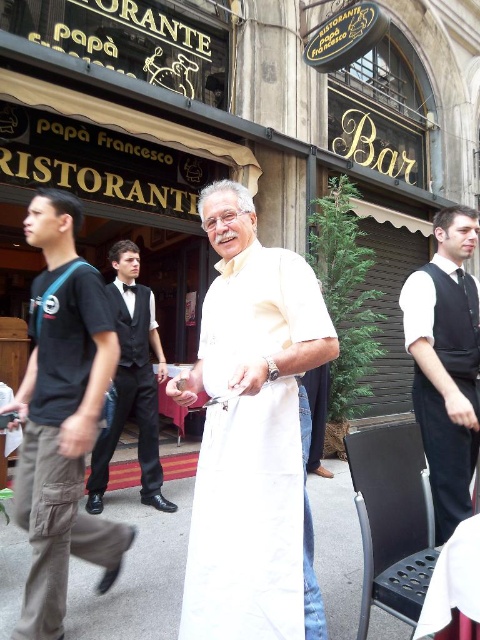
Can you confirm if black cotton t-shirt at left is positioned above black satin vest at right?

No.

Is point (45, 481) closer to camera compared to point (415, 397)?

Yes, point (45, 481) is in front of point (415, 397).

What do you see at coordinates (61, 417) in the screenshot? I see `black cotton t-shirt at left` at bounding box center [61, 417].

What are the coordinates of `black cotton t-shirt at left` in the screenshot? It's located at (61, 417).

Between white fabric apron at center and black satin vest at center, which one is positioned lower?

black satin vest at center is below.

Who is positioned more to the left, white fabric apron at center or black satin vest at center?

black satin vest at center is more to the left.

Describe the element at coordinates (252, 435) in the screenshot. I see `white fabric apron at center` at that location.

This screenshot has height=640, width=480. I want to click on white fabric apron at center, so click(x=252, y=435).

Does point (276, 618) lie behind point (16, 508)?

No, (276, 618) is in front of (16, 508).

Between point (269, 317) and point (31, 483), which one is positioned in front?

Point (269, 317) is in front.

Who is more distant from viewer, [168,380] or [86,262]?

The point [168,380] is behind.

This screenshot has width=480, height=640. What are the coordinates of `white fabric apron at center` in the screenshot? It's located at (252, 435).